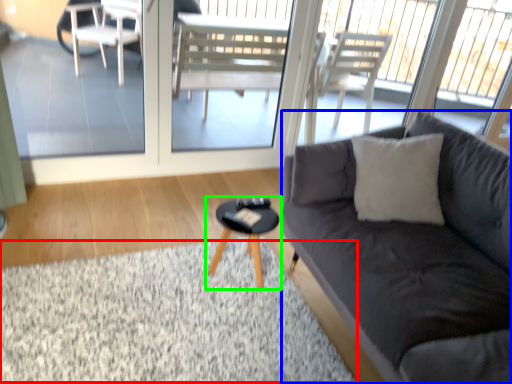
Question: Which object is the closest to the flat (highlighted by a red box)? Choose among these: studio couch (highlighted by a blue box) or coffee table (highlighted by a green box).

Choices:
 (A) studio couch
 (B) coffee table

Answer: (B)